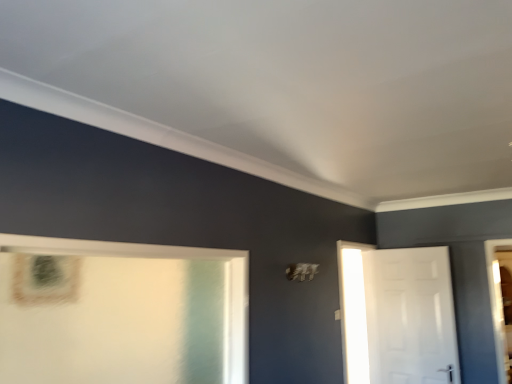
Question: Does point (39, 367) appear closer or farther from the camera than point (407, 266)?

Choices:
 (A) farther
 (B) closer

Answer: (B)

Question: Considering the positions of white glossy door at left and white glossy door at right in the image, is white glossy door at left taller or shorter than white glossy door at right?

Choices:
 (A) tall
 (B) short

Answer: (B)

Question: Is white glossy door at left inside or outside of white glossy door at right?

Choices:
 (A) inside
 (B) outside

Answer: (B)

Question: Based on their positions, is white glossy door at right located to the left or right of white glossy door at left?

Choices:
 (A) right
 (B) left

Answer: (A)

Question: In terms of width, does white glossy door at right look wider or thinner when compared to white glossy door at left?

Choices:
 (A) wide
 (B) thin

Answer: (B)

Question: Is point (440, 274) positioned closer to the camera than point (164, 302)?

Choices:
 (A) farther
 (B) closer

Answer: (A)

Question: From a real-world perspective, is white glossy door at right physically located above or below white glossy door at left?

Choices:
 (A) above
 (B) below

Answer: (B)